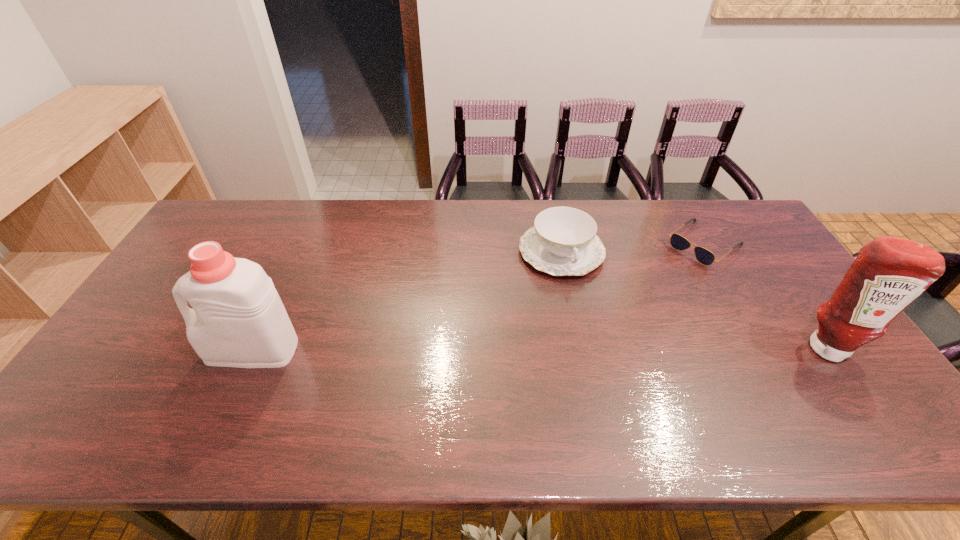
Identify the location of vacant area at the far edge. This screenshot has width=960, height=540. (473, 225).

I want to click on vacant space at the near edge, so click(187, 381).

Where is `vacant space at the left edge`? vacant space at the left edge is located at coordinates (100, 364).

Image resolution: width=960 pixels, height=540 pixels. What are the coordinates of `free spot at the right edge of the desktop` in the screenshot? It's located at pyautogui.click(x=772, y=318).

Locate an element on the screen. vacant space at the near right corner is located at coordinates (838, 375).

Where is `vacant point located between the chinaware and the leftmost object`? The image size is (960, 540). vacant point located between the chinaware and the leftmost object is located at coordinates (407, 301).

Identify the location of free space between the sunglasses and the leftmost object. This screenshot has width=960, height=540. (478, 297).

Find the location of a particular element. This screenshot has width=960, height=540. vacant area that lies between the second object from left to right and the detergent is located at coordinates (407, 301).

The image size is (960, 540). What are the coordinates of `vacant area between the chinaware and the sunglasses` in the screenshot? It's located at (633, 248).

Identify the location of free space between the condiment and the chinaware. (694, 299).